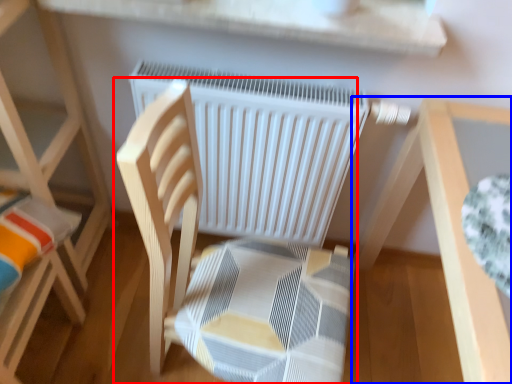
Question: Which object appears farthest to the camera in this image, chair (highlighted by a red box) or table (highlighted by a blue box)?

Choices:
 (A) chair
 (B) table

Answer: (B)